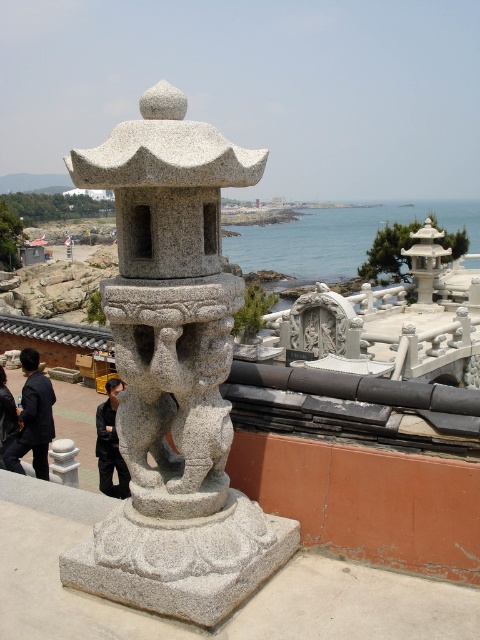
Who is more forward, [110,438] or [60,444]?

Point [60,444] is more forward.

Is point (108, 460) more distant than point (58, 451)?

Yes, it is behind point (58, 451).

The height and width of the screenshot is (640, 480). What are the coordinates of `black matte jacket at center` in the screenshot? It's located at (109, 444).

I want to click on black matte jacket at center, so click(109, 444).

Does blue water at center have a larger size compared to black fabric jacket at lower left?

Correct, blue water at center is larger in size than black fabric jacket at lower left.

Who is shorter, blue water at center or black fabric jacket at lower left?

With less height is black fabric jacket at lower left.

At what (x,y) coordinates should I click in order to perform the action: click on blue water at center. Please return your answer as a coordinate pair (x, y). Looking at the image, I should click on (338, 237).

Between granite statue at center and blue water at center, which one is positioned higher?

Positioned higher is blue water at center.

Which of these two, granite statue at center or blue water at center, stands taller?

blue water at center is taller.

Locate an element on the screen. granite statue at center is located at coordinates (173, 374).

Locate an element on the screen. The image size is (480, 640). granite statue at center is located at coordinates (173, 374).